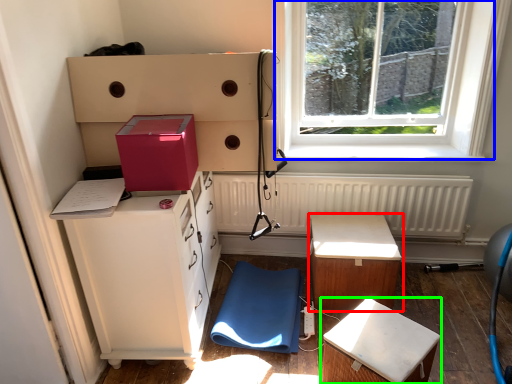
Question: Which is nearer to the table (highlighted by a red box)? window (highlighted by a blue box) or furniture (highlighted by a green box).

Choices:
 (A) window
 (B) furniture

Answer: (B)